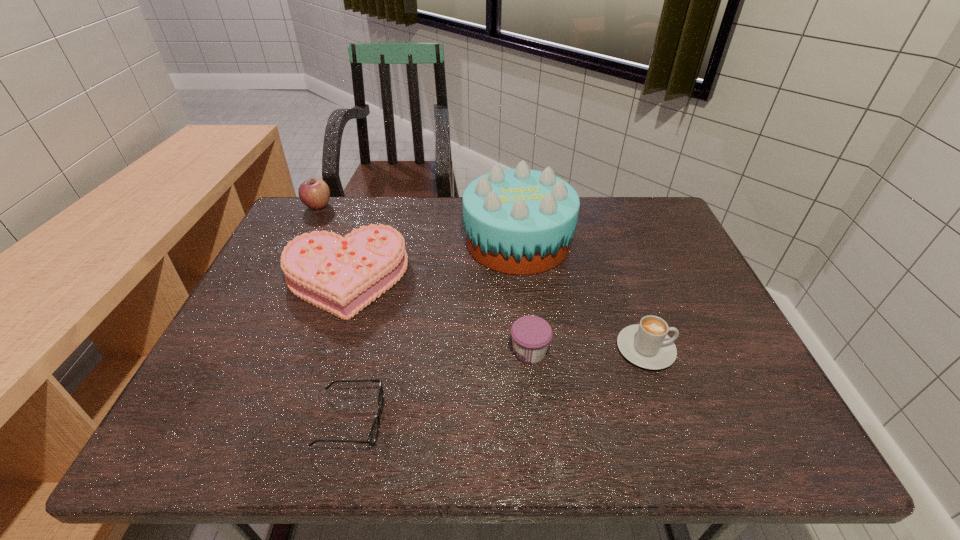
Find the location of a particular element. The image size is (960, 540). free space located 0.080m on the back of the left cake is located at coordinates (362, 228).

Where is `vacant space located 0.100m to the right of the cappuccino`? This screenshot has width=960, height=540. vacant space located 0.100m to the right of the cappuccino is located at coordinates (718, 349).

Image resolution: width=960 pixels, height=540 pixels. I want to click on blank space located 0.290m on the front label of the jam, so click(380, 352).

Identify the location of free space located 0.150m on the front label of the jam. (443, 352).

This screenshot has height=540, width=960. Find the location of `vacant region located on the front label of the jam`. vacant region located on the front label of the jam is located at coordinates (398, 352).

Locate an element on the screen. Image resolution: width=960 pixels, height=540 pixels. blank space located on the front-facing side of the spectacles is located at coordinates (551, 420).

This screenshot has height=540, width=960. Find the location of `cake that is at the far edge`. cake that is at the far edge is located at coordinates (519, 221).

Locate an element on the screen. This screenshot has height=540, width=960. apple that is at the far edge is located at coordinates (314, 193).

Identify the location of object at the near edge. The width and height of the screenshot is (960, 540). (374, 432).

Where is `apple that is at the left edge`? The width and height of the screenshot is (960, 540). apple that is at the left edge is located at coordinates (314, 193).